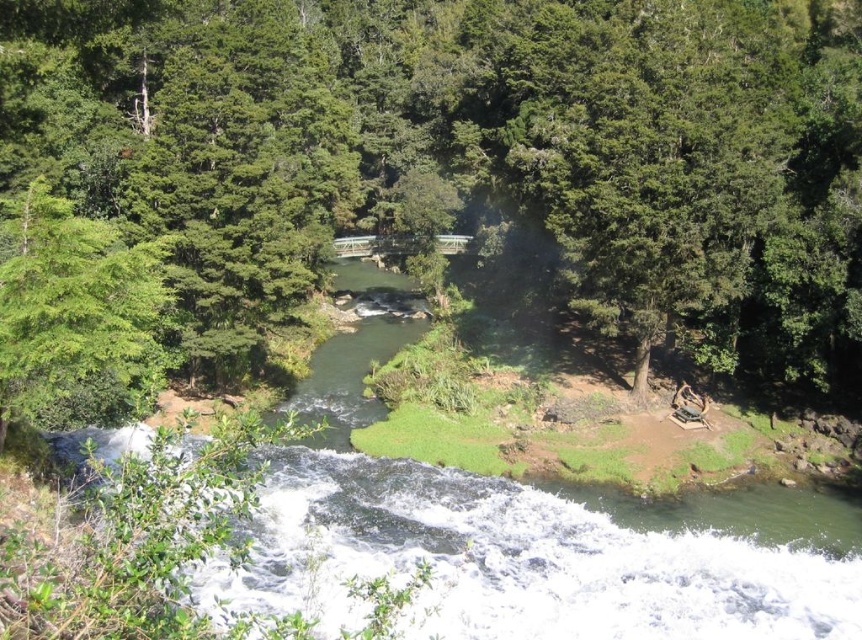
Which is more to the left, green leafy tree at center or green leafy tree at left?

Positioned to the left is green leafy tree at left.

In the scene shown: Is green leafy tree at center smaller than green leafy tree at left?

No, green leafy tree at center is not smaller than green leafy tree at left.

Between point (832, 20) and point (23, 220), which one is positioned in front?

Positioned in front is point (23, 220).

Locate an element on the screen. green leafy tree at center is located at coordinates (476, 148).

Does green leafy tree at upper right appear over green leafy tree at left?

Correct, green leafy tree at upper right is located above green leafy tree at left.

Which is above, green leafy tree at upper right or green leafy tree at left?

green leafy tree at upper right is above.

Where is `green leafy tree at upper right`? green leafy tree at upper right is located at coordinates (650, 148).

This screenshot has width=862, height=640. Identify the location of green leafy tree at upper right. (650, 148).

Is green leafy tree at center wider than green leafy tree at upper right?

Correct, the width of green leafy tree at center exceeds that of green leafy tree at upper right.

Does green leafy tree at center have a larger size compared to green leafy tree at upper right?

Correct, green leafy tree at center is larger in size than green leafy tree at upper right.

This screenshot has width=862, height=640. What are the coordinates of `green leafy tree at center` in the screenshot? It's located at (476, 148).

This screenshot has width=862, height=640. What are the coordinates of `green leafy tree at center` in the screenshot? It's located at (476, 148).